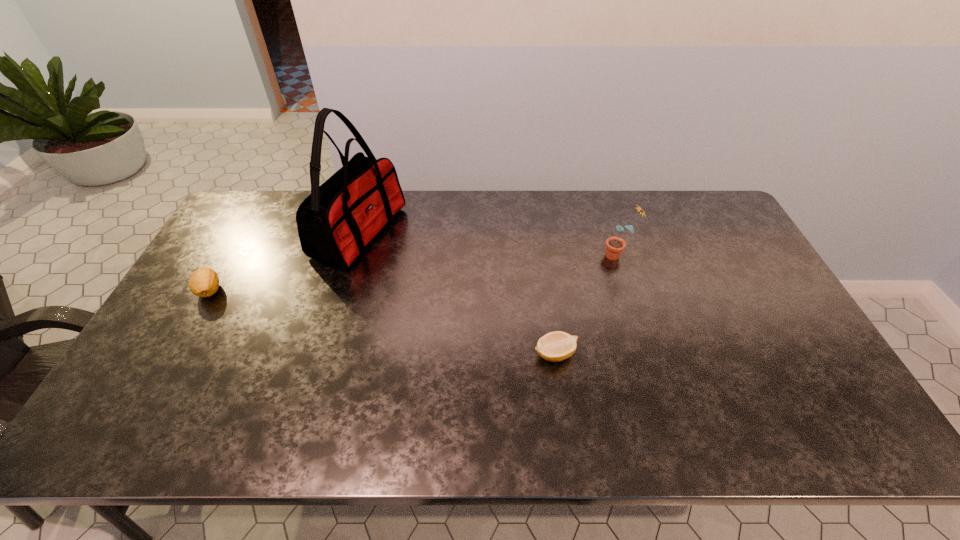
The width and height of the screenshot is (960, 540). I want to click on free area in between the shortest object and the second object from left to right, so click(x=457, y=293).

Where is `object that is the closest to the shorter lemon`? This screenshot has width=960, height=540. object that is the closest to the shorter lemon is located at coordinates [614, 245].

Locate which object ranks second in proximity to the nearest object. Please provide its 2D coordinates. Your answer should be formatted as a tuple, i.e. [(x, y)], where the tuple contains the x and y coordinates of a point satisfying the conditions above.

[(337, 221)]

I want to click on blank space that satisfies the following two spatial constraints: 1. on the flower of the sunflower; 2. at the stem end of the second shortest object, so click(x=629, y=291).

Where is `vacant space that satisfies the following two spatial constraints: 1. at the stem end of the third tallest object; 2. on the right side of the shortest object`? This screenshot has width=960, height=540. vacant space that satisfies the following two spatial constraints: 1. at the stem end of the third tallest object; 2. on the right side of the shortest object is located at coordinates (174, 354).

Identify the location of free space that satisfies the following two spatial constraints: 1. at the stem end of the nearest object; 2. on the left side of the farther lemon. The height and width of the screenshot is (540, 960). (174, 354).